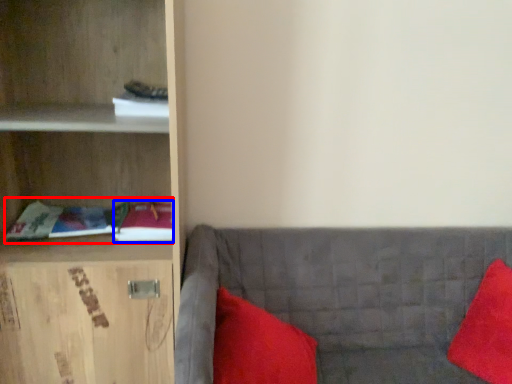
Question: Among these objects, which one is farthest to the camera, book (highlighted by a red box) or book (highlighted by a blue box)?

Choices:
 (A) book
 (B) book

Answer: (B)